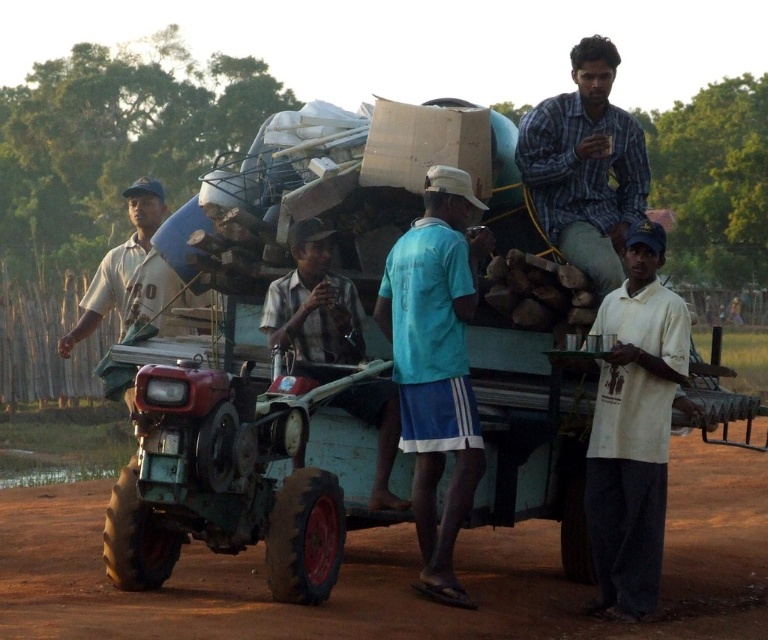
Question: Based on their relative distances, which object is farther from the white cotton shirt at center?

Choices:
 (A) blue fabric shirt at center
 (B) plaid shirt at upper right

Answer: (A)

Question: Which point is closer to the camera taking this photo?

Choices:
 (A) (573, 113)
 (B) (386, 305)
 (C) (596, 412)

Answer: (C)

Question: Does blue fabric shirt at center have a greater width compared to plaid shirt at upper right?

Choices:
 (A) yes
 (B) no

Answer: (B)

Question: Does white cotton shirt at center appear under plaid shirt at upper right?

Choices:
 (A) no
 (B) yes

Answer: (B)

Question: Which point is closer to the camera?

Choices:
 (A) white cotton shirt at center
 (B) blue fabric shirt at center
 (C) plaid shirt at upper right

Answer: (B)

Question: Observing the image, what is the correct spatial positioning of blue fabric shirt at center in reference to plaid shirt at upper right?

Choices:
 (A) above
 (B) below

Answer: (B)